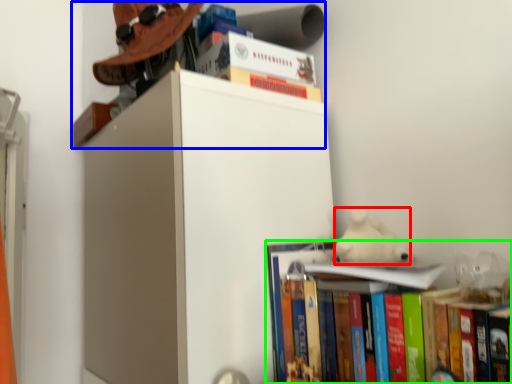
Question: Considering the real-world distances, which object is closest to animal (highlighted by a red box)? shelf (highlighted by a blue box) or book (highlighted by a green box).

Choices:
 (A) shelf
 (B) book

Answer: (B)